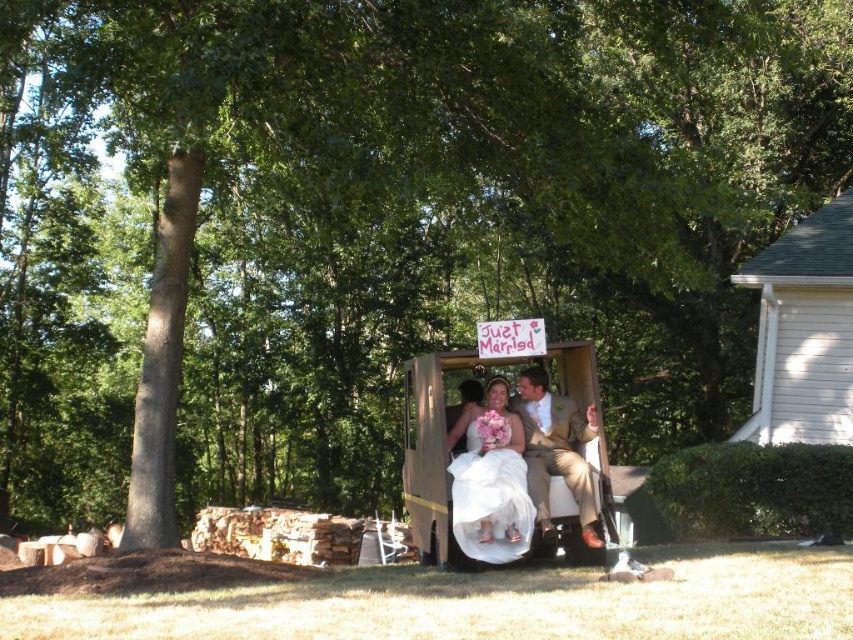
You are a photographer taking a picture of the white satin dress at center and the light brown textured suit at center. Which one is closer to the camera?

The white satin dress at center is positioned under the light brown textured suit at center, so the light brown textured suit at center is closer to the camera.

You are a photographer standing at the point marked by the coordinates point [491,481]. You want to take a photo of the white satin dress at center. Which direction should you move to get a better angle?

The point marked by the coordinates point [491,481] is already at the white satin dress at center, so you are already positioned directly at the dress. To get a better angle, you might need to move slightly to the side or adjust your camera angle instead of moving forward or backward.